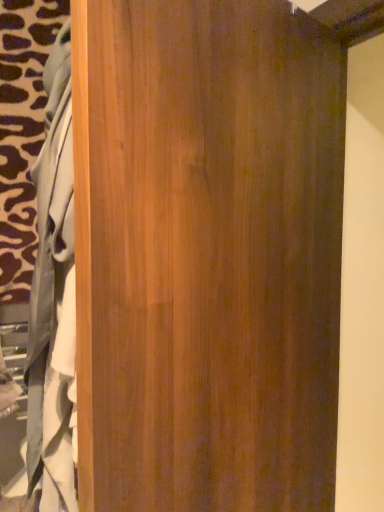
What is the approximate height of matte wood door at center?

The height of matte wood door at center is 1.26 meters.

What do you see at coordinates (207, 255) in the screenshot? I see `matte wood door at center` at bounding box center [207, 255].

Where is `matte wood door at center`? matte wood door at center is located at coordinates (207, 255).

What is the approximate width of matte wood door at center?

The width of matte wood door at center is 5.70 inches.

Where is `matte wood door at center`? matte wood door at center is located at coordinates (207, 255).